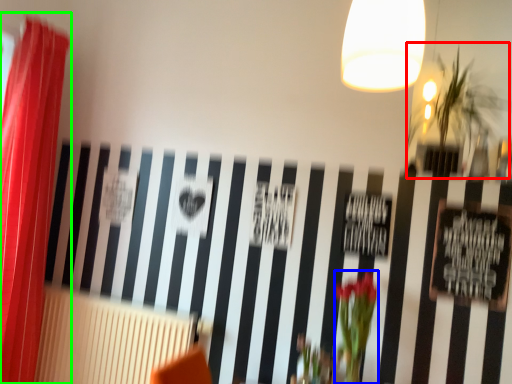
Question: Which object is the farthest from plant (highlighted by a red box)? Choose among these: floral arrangement (highlighted by a blue box) or curtain (highlighted by a green box).

Choices:
 (A) floral arrangement
 (B) curtain

Answer: (B)